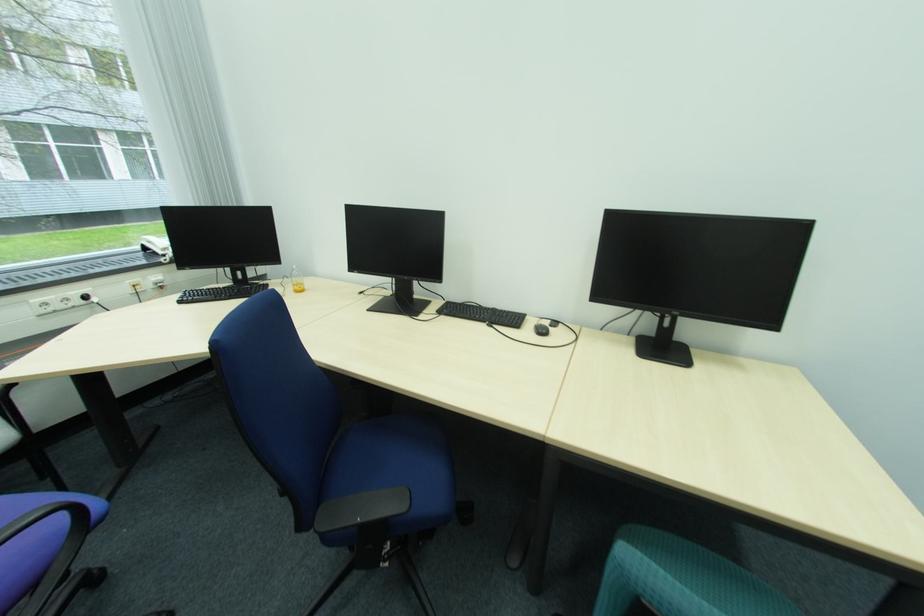
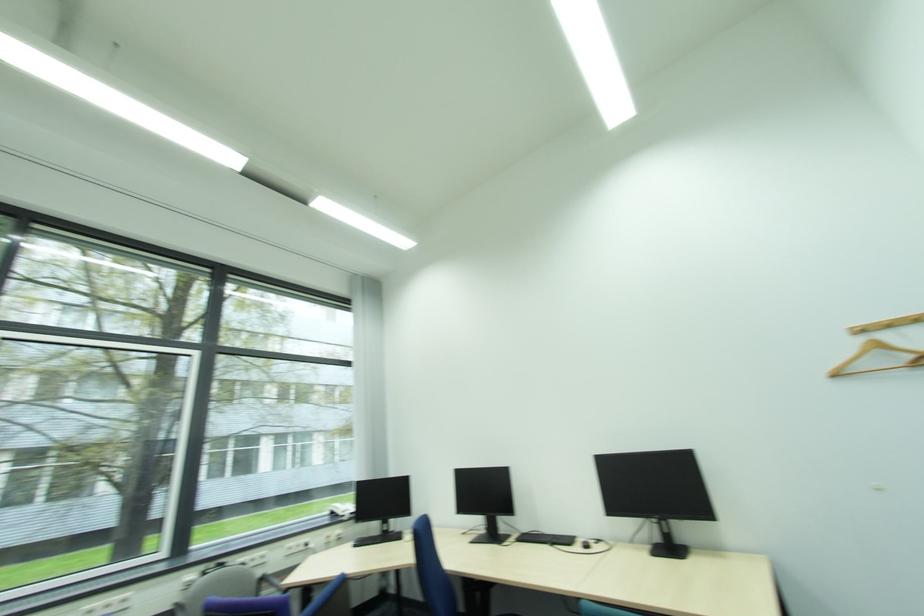
Where in the second image is the point corresponding to the point at 533,318 from the first image?

(584, 539)